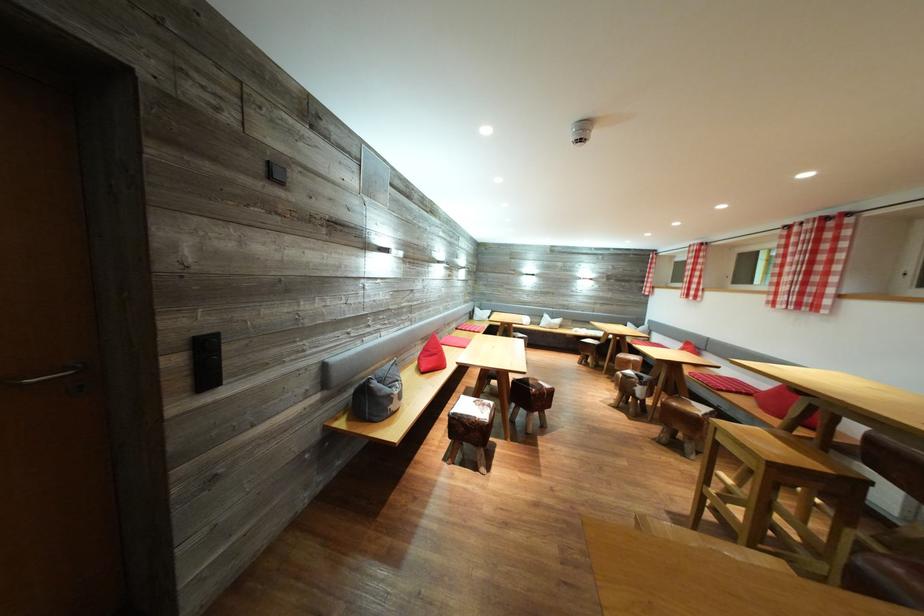
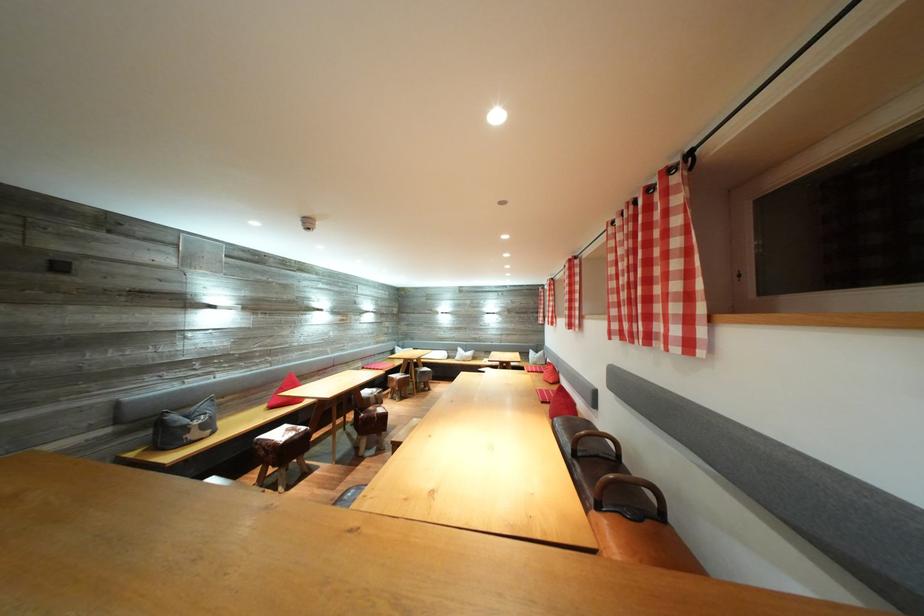
Where in the second image is the point corresponding to [394,395] from the first image?

(192, 427)